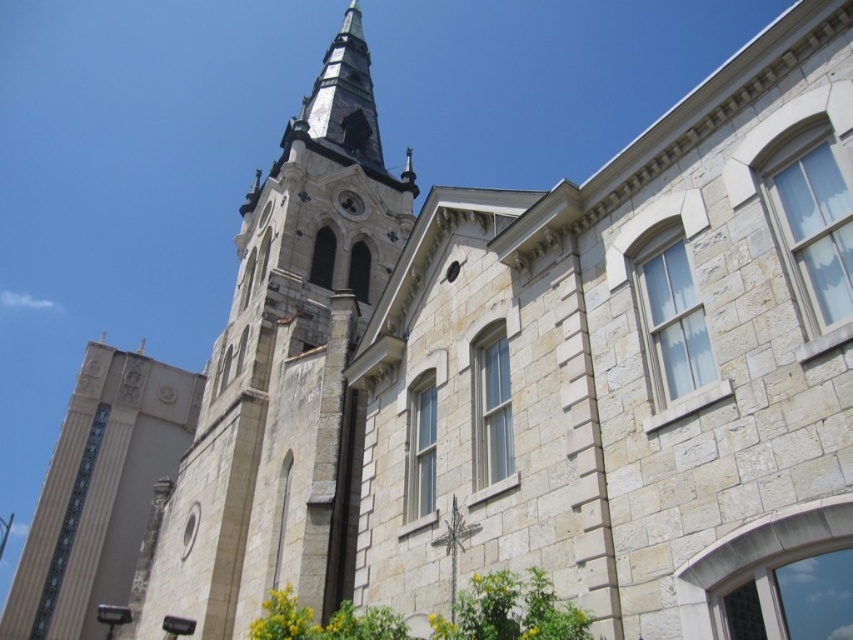
Question: Which object is closer to the camera taking this photo?

Choices:
 (A) stone steeple at center
 (B) beige stone tower at center

Answer: (A)

Question: Can you confirm if stone steeple at center is thinner than beige stone tower at center?

Choices:
 (A) no
 (B) yes

Answer: (A)

Question: Is stone steeple at center bigger than beige stone tower at center?

Choices:
 (A) no
 (B) yes

Answer: (B)

Question: Does stone steeple at center appear under beige stone tower at center?

Choices:
 (A) yes
 (B) no

Answer: (B)

Question: Among these objects, which one is nearest to the camera?

Choices:
 (A) beige stone tower at center
 (B) stone steeple at center

Answer: (B)